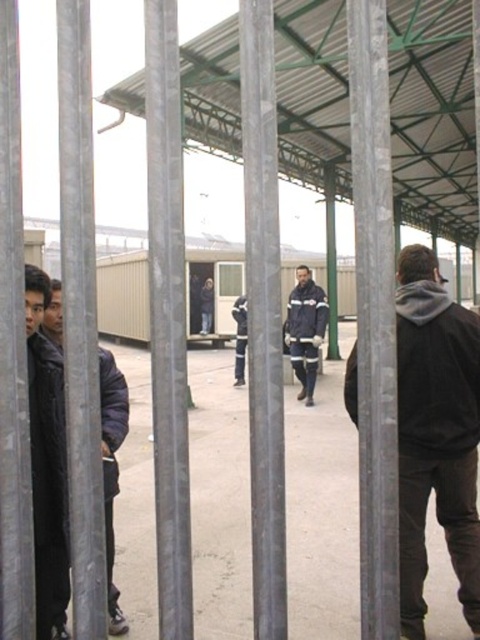
Who is higher up, dark blue jacket at left or dark blue fabric jacket at center?

Positioned higher is dark blue fabric jacket at center.

Is dark blue jacket at left shorter than dark blue fabric jacket at center?

Correct, dark blue jacket at left is not as tall as dark blue fabric jacket at center.

You are a GUI agent. You are given a task and a screenshot of the screen. Output one action in this format:
    pyautogui.click(x=<x>, y=<y>)
    Task: Click on the dark blue jacket at left
    
    Given the screenshot: What is the action you would take?
    pyautogui.click(x=111, y=467)

Can you confirm if dark gray hoodie at right is smaller than dark blue jacket at left?

Indeed, dark gray hoodie at right has a smaller size compared to dark blue jacket at left.

Does dark gray hoodie at right lie behind dark blue jacket at left?

Yes, dark gray hoodie at right is behind dark blue jacket at left.

Is point (415, 592) less distant than point (55, 332)?

No, it is behind (55, 332).

Where is `dark gray hoodie at right`? This screenshot has width=480, height=640. dark gray hoodie at right is located at coordinates (435, 435).

Does point (420, 579) come in front of point (290, 307)?

Yes, point (420, 579) is closer to viewer.

Based on the photo, can you confirm if dark gray hoodie at right is taller than dark blue fabric jacket at center?

In fact, dark gray hoodie at right may be shorter than dark blue fabric jacket at center.

Which is in front, point (470, 584) or point (298, 358)?

Point (470, 584) is more forward.

Locate an element on the screen. This screenshot has width=480, height=640. dark gray hoodie at right is located at coordinates (435, 435).